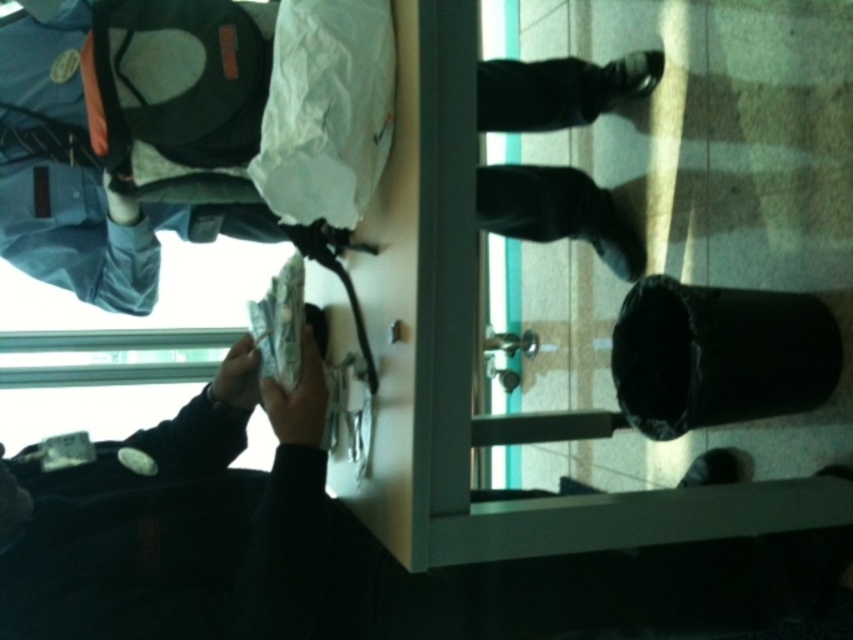
Question: Observing the image, what is the correct spatial positioning of white paper money at lower left in reference to black leather shoes at center?

Choices:
 (A) right
 (B) left

Answer: (B)

Question: Observing the image, what is the correct spatial positioning of white paper money at lower left in reference to black leather shoes at center?

Choices:
 (A) right
 (B) left

Answer: (B)

Question: Which point is closer to the camera?

Choices:
 (A) black leather shoes at center
 (B) white paper money at lower left

Answer: (B)

Question: Is white paper money at lower left thinner than black leather shoes at center?

Choices:
 (A) no
 (B) yes

Answer: (A)

Question: Which object is farther from the camera taking this photo?

Choices:
 (A) black leather shoes at center
 (B) white paper money at lower left

Answer: (A)